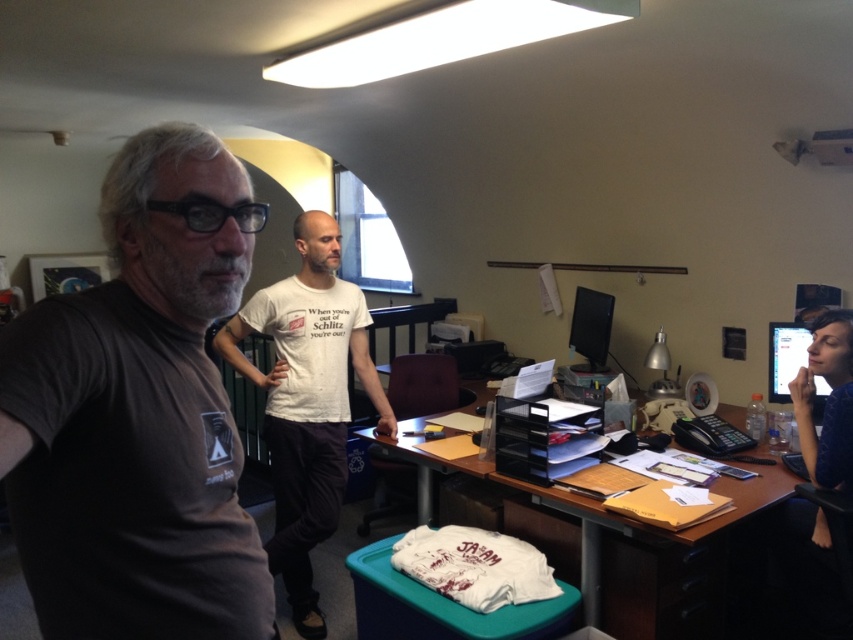
Question: Which of the following is the farthest from the observer?

Choices:
 (A) white cotton t-shirt at center
 (B) wooden desk at center

Answer: (A)

Question: Considering the real-world distances, which object is farthest from the matte black monitor at right?

Choices:
 (A) matte black monitor at upper right
 (B) wooden desk at center
 (C) dark gray t-shirt at left
 (D) blue fabric shirt at lower right

Answer: (C)

Question: Is dark gray t-shirt at left to the right of matte black monitor at upper right from the viewer's perspective?

Choices:
 (A) no
 (B) yes

Answer: (A)

Question: Is dark gray t-shirt at left to the left of matte black monitor at upper right from the viewer's perspective?

Choices:
 (A) no
 (B) yes

Answer: (B)

Question: Which of the following is the farthest from the observer?

Choices:
 (A) wooden desk at center
 (B) blue fabric shirt at lower right

Answer: (B)

Question: Can you confirm if wooden desk at center is positioned to the right of blue fabric shirt at lower right?

Choices:
 (A) no
 (B) yes

Answer: (A)